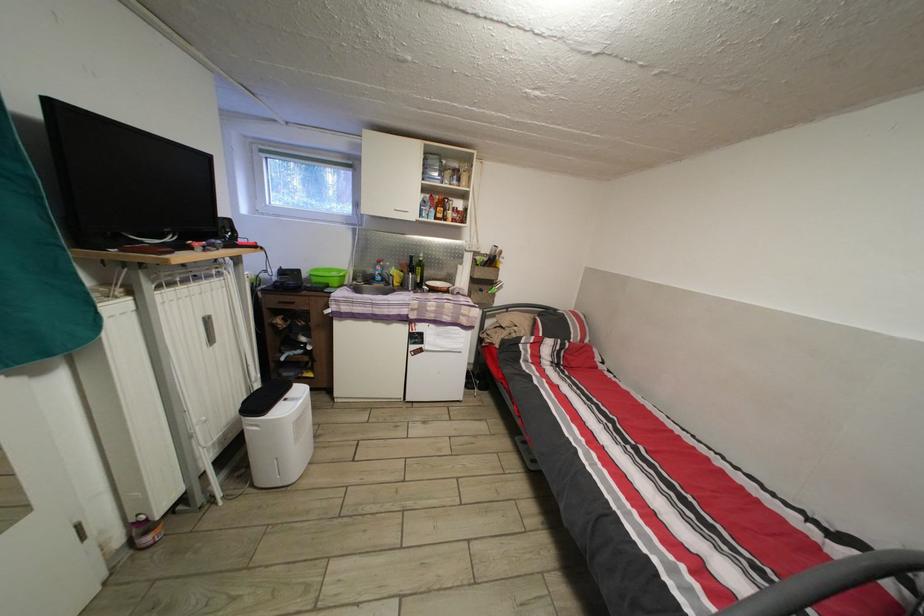
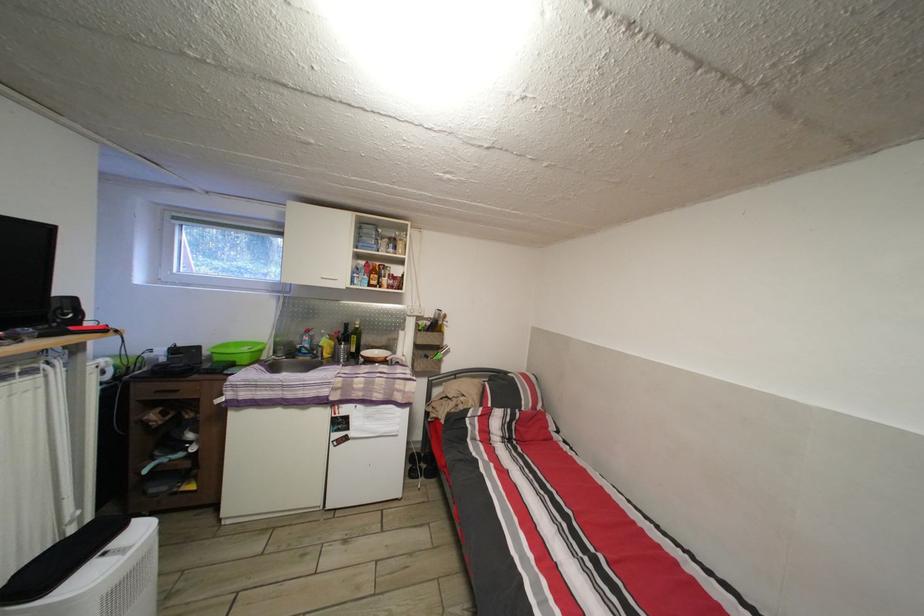
Question: I am providing you with two images of the same scene from different viewpoints. Please identify which objects are invisible in image2.

Choices:
 (A) white cabinet handle
 (B) drawer handle
 (C) yellow plastic bottle
 (D) none of these

Answer: (D)